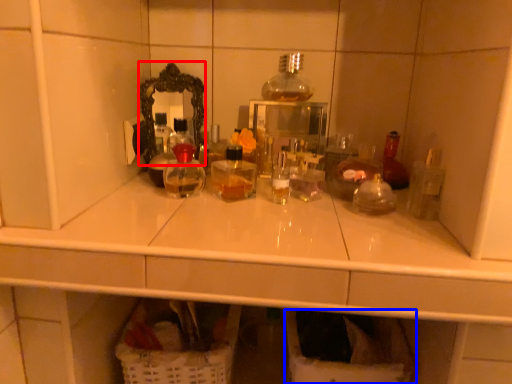
Question: Which point is closer to the camera, mirror (highlighted by a red box) or laundry basket (highlighted by a blue box)?

Choices:
 (A) mirror
 (B) laundry basket

Answer: (B)